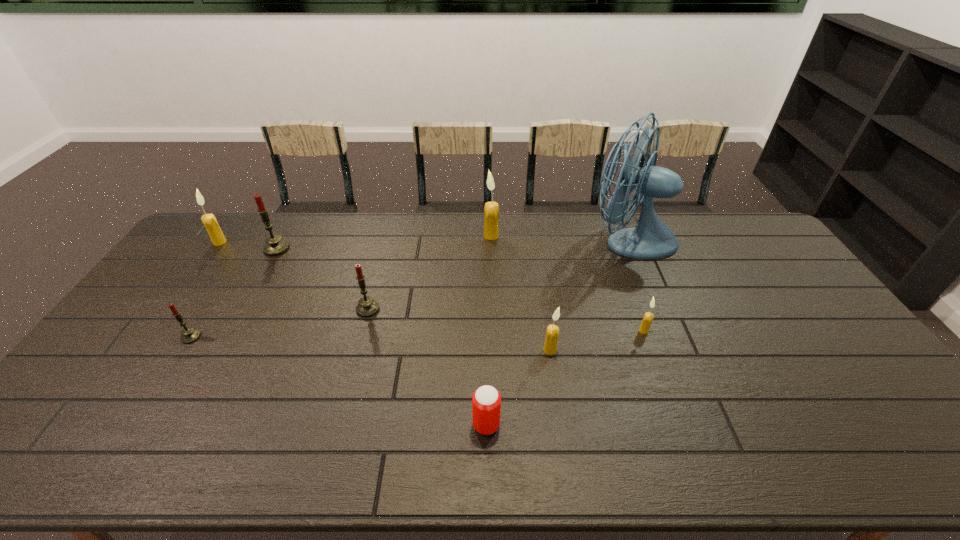
What are the coordinates of `vacant space located 0.160m on the left of the fifth candle from left to right` in the screenshot? It's located at (441, 236).

Image resolution: width=960 pixels, height=540 pixels. Identify the location of vacant space positioned on the right of the third candle from left to right. (315, 248).

This screenshot has width=960, height=540. What are the coordinates of `vacant space positioned 0.150m on the back of the third smallest cream candle` in the screenshot? It's located at (239, 215).

Identify the location of free spot located on the right of the fourth farthest candle. The height and width of the screenshot is (540, 960). (413, 309).

You are a GUI agent. You are given a task and a screenshot of the screen. Output one action in this format:
    pyautogui.click(x=<x>, y=<y>)
    Task: Click on the free region located 0.100m on the front of the nearest candle
    The image size is (960, 540).
    Given the screenshot: What is the action you would take?
    pyautogui.click(x=555, y=386)

Image resolution: width=960 pixels, height=540 pixels. What are the coordinates of `vacant space located 0.130m on the front of the smallest red candle` in the screenshot? It's located at (162, 383).

Where is `blank area located on the right of the rightmost cream candle`? The height and width of the screenshot is (540, 960). blank area located on the right of the rightmost cream candle is located at coordinates (752, 331).

At what (x,y) coordinates should I click in order to perform the action: click on vacant area situated 0.390m on the left of the nearest object. Please return your answer as a coordinate pair (x, y). This screenshot has width=960, height=540. Looking at the image, I should click on (310, 424).

Locate an element on the screen. fan that is at the far edge is located at coordinates (651, 238).

The width and height of the screenshot is (960, 540). I want to click on object that is at the near edge, so click(486, 402).